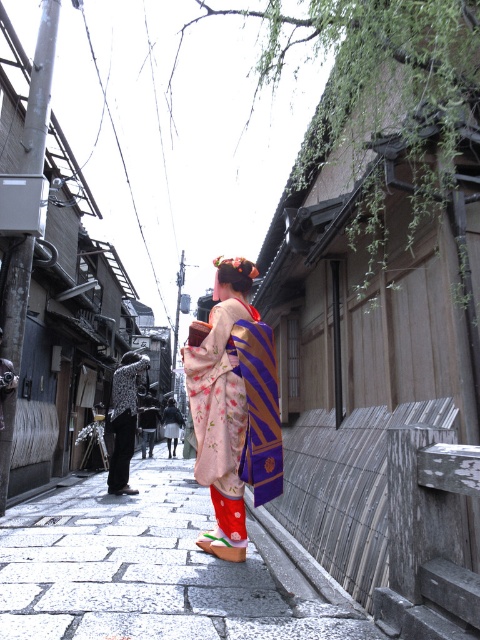
Based on the photo, is floral silk kimono at center further to camera compared to black textured kimono at center?

No.

Does floral silk kimono at center have a greater width compared to black textured kimono at center?

Yes, floral silk kimono at center is wider than black textured kimono at center.

The image size is (480, 640). Describe the element at coordinates (233, 408) in the screenshot. I see `floral silk kimono at center` at that location.

This screenshot has height=640, width=480. I want to click on floral silk kimono at center, so click(x=233, y=408).

Is white stone pavement at center thinner than black textured kimono at center?

In fact, white stone pavement at center might be wider than black textured kimono at center.

Between white stone pavement at center and black textured kimono at center, which one is positioned lower?

white stone pavement at center is below.

Does point (302, 596) come in front of point (120, 404)?

Yes, it is in front of point (120, 404).

Identify the location of white stone pavement at center. Image resolution: width=480 pixels, height=640 pixels. (151, 570).

Who is positioned more to the left, white stone pavement at center or floral silk kimono at center?

From the viewer's perspective, white stone pavement at center appears more on the left side.

Does point (159, 580) lie in front of point (226, 429)?

Yes, it is in front of point (226, 429).

You are a GUI agent. You are given a task and a screenshot of the screen. Output one action in this format:
    pyautogui.click(x=<x>, y=<y>)
    Task: Click on the white stone pavement at center
    Image resolution: width=480 pixels, height=640 pixels.
    Given the screenshot: What is the action you would take?
    pyautogui.click(x=151, y=570)